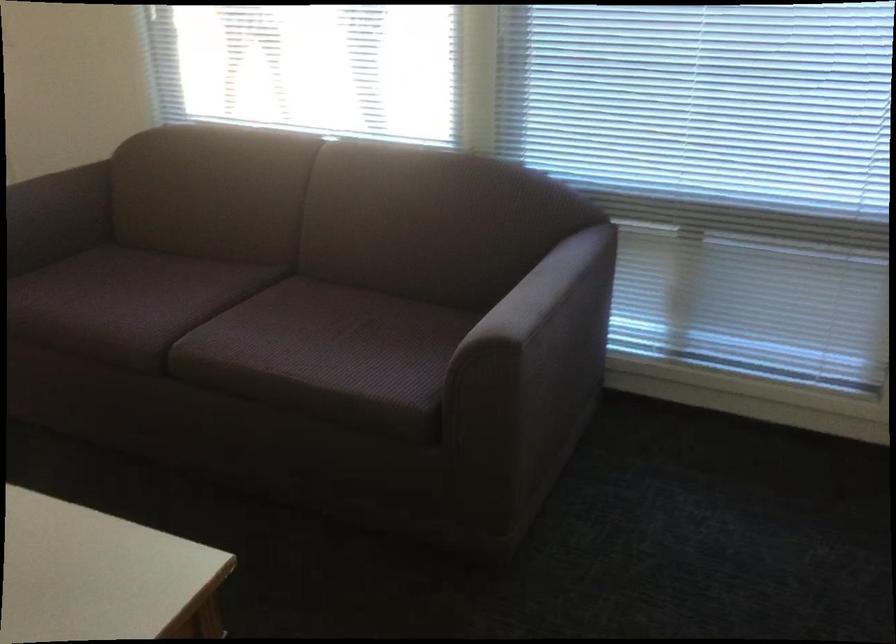
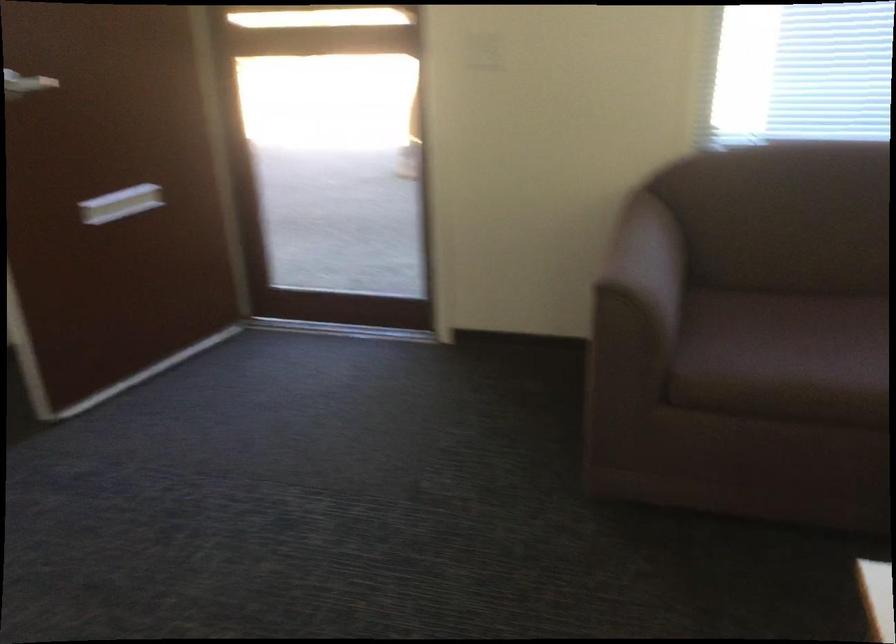
Where in the second image is the point corresponding to (x=100, y=288) from the first image?

(786, 337)